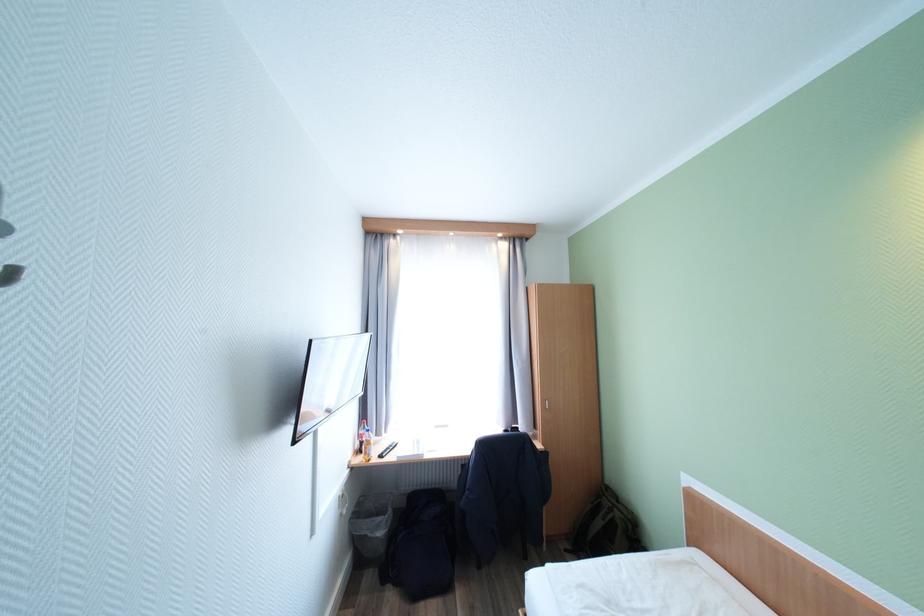
What are the coordinates of `red bottle cap` in the screenshot? It's located at (362, 422).